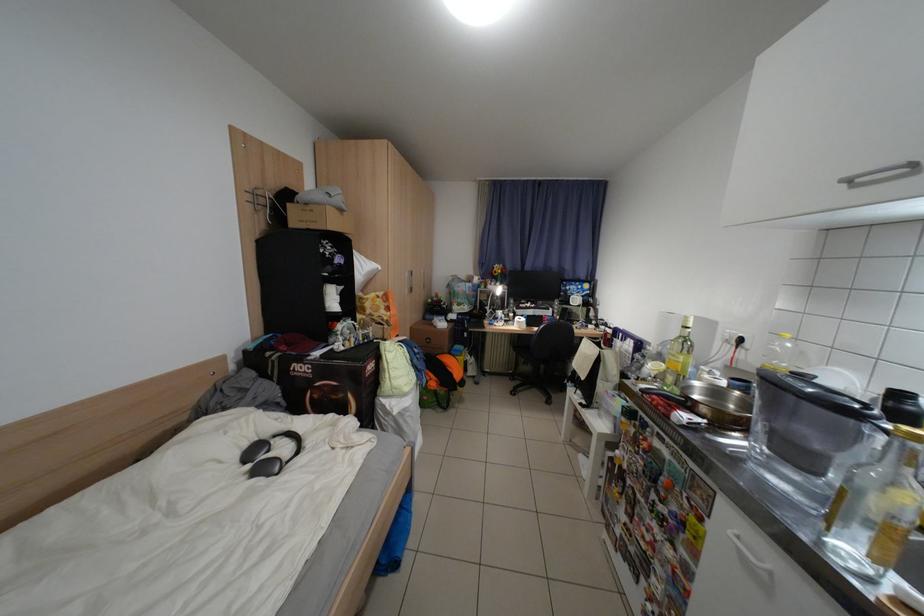
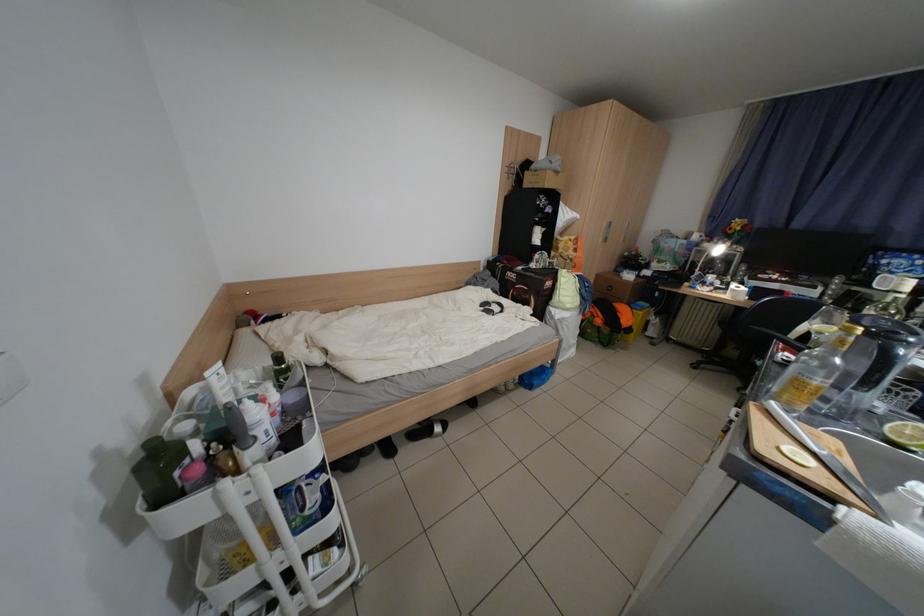
Where in the second image is the point corresponding to point (261, 468) from the first image?

(493, 310)